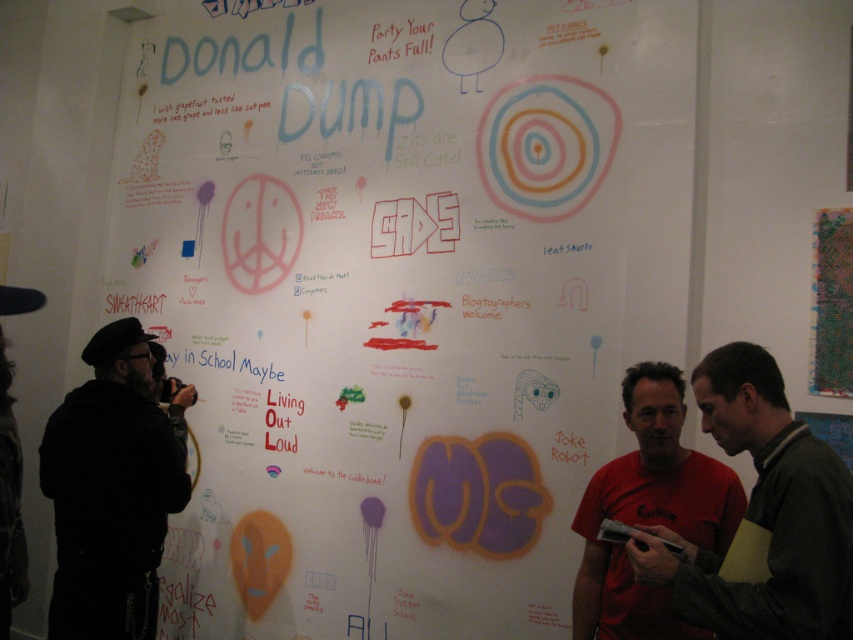
You are standing in front of the whiteboard and want to place a new poster. Considering the white paper poster at center and the matte black shirt at center, which object is wider?

The white paper poster at center is wider than the matte black shirt at center.

You are standing in front of the wall with messages and drawings. You see a point at coordinate [764,513]. What is located at that point?

The point at coordinate [764,513] is occupied by a matte black shirt at center.

You are standing in front of the wall with the white paper poster at center and the matte black shirt at center. Which object is positioned more to the left?

The white paper poster at center is positioned more to the left than the matte black shirt at center.